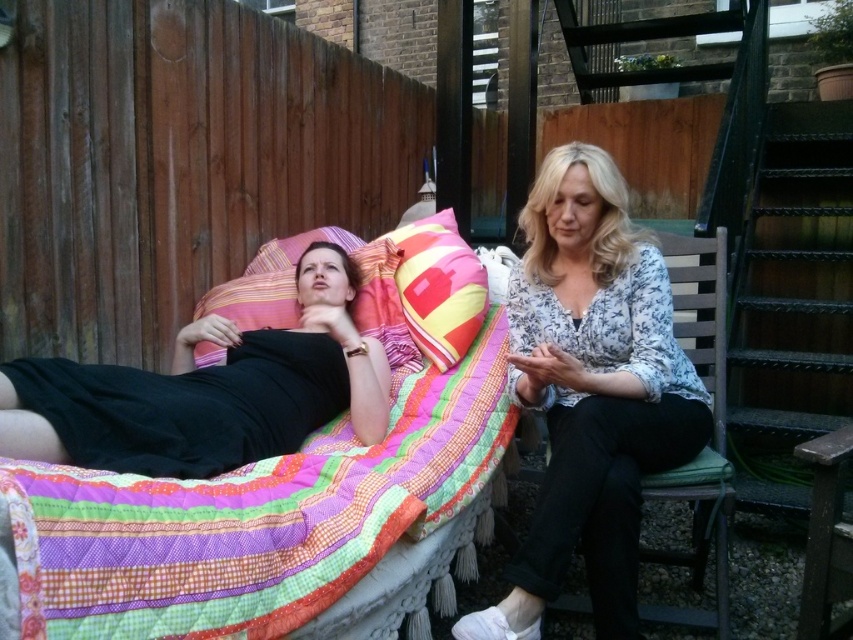
Question: Which of the following is the farthest from the observer?

Choices:
 (A) striped fabric pillow at upper left
 (B) floral blouse at center
 (C) black matte dress at center
 (D) quilted cotton blanket at center

Answer: (A)

Question: Does quilted cotton blanket at center appear over floral blouse at center?

Choices:
 (A) yes
 (B) no

Answer: (B)

Question: Based on their relative distances, which object is farther from the quilted cotton blanket at center?

Choices:
 (A) striped fabric pillow at upper left
 (B) black matte dress at center
 (C) multicolored quilted pillow at center
 (D) floral blouse at center

Answer: (A)

Question: Which of these objects is positioned closest to the striped fabric pillow at upper left?

Choices:
 (A) black matte dress at center
 (B) quilted cotton blanket at center

Answer: (A)

Question: Does quilted cotton blanket at center appear on the left side of floral blouse at center?

Choices:
 (A) yes
 (B) no

Answer: (A)

Question: Is quilted cotton blanket at center closer to camera compared to black matte dress at center?

Choices:
 (A) yes
 (B) no

Answer: (A)